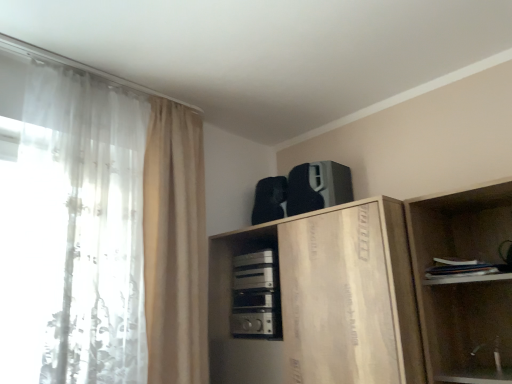
Question: Which direction should I rotate to face black matte speaker at upper center, marked as the second appliance in a bottom-to-top arrangement, — up or down?

Choices:
 (A) down
 (B) up

Answer: (A)

Question: From a real-world perspective, is white sheer curtain at left, which appears as the first curtain when viewed from the left, beneath white paper book at right?

Choices:
 (A) no
 (B) yes

Answer: (A)

Question: Could you tell me if white sheer curtain at left, acting as the second curtain starting from the right, is facing white paper book at right?

Choices:
 (A) no
 (B) yes

Answer: (A)

Question: Can you confirm if white sheer curtain at left, which appears as the first curtain when viewed from the left, is thinner than white paper book at right?

Choices:
 (A) no
 (B) yes

Answer: (A)

Question: Is there a large distance between white sheer curtain at left, acting as the second curtain starting from the right, and white paper book at right?

Choices:
 (A) yes
 (B) no

Answer: (A)

Question: Is white sheer curtain at left, acting as the second curtain starting from the right, next to white paper book at right?

Choices:
 (A) yes
 (B) no

Answer: (B)

Question: Could white paper book at right be considered to be inside white sheer curtain at left, acting as the second curtain starting from the right?

Choices:
 (A) no
 (B) yes

Answer: (A)

Question: Considering the relative sizes of beige fabric curtain at left, which is counted as the 1th curtain, starting from the right, and white sheer curtain at left, acting as the second curtain starting from the right, in the image provided, is beige fabric curtain at left, which is counted as the 1th curtain, starting from the right, bigger than white sheer curtain at left, acting as the second curtain starting from the right,?

Choices:
 (A) no
 (B) yes

Answer: (B)

Question: Is beige fabric curtain at left, which ranks as the second curtain in left-to-right order, surrounding white sheer curtain at left, acting as the second curtain starting from the right?

Choices:
 (A) yes
 (B) no

Answer: (B)

Question: Does beige fabric curtain at left, which is counted as the 1th curtain, starting from the right, appear on the left side of white sheer curtain at left, acting as the second curtain starting from the right?

Choices:
 (A) no
 (B) yes

Answer: (A)

Question: Is beige fabric curtain at left, which is counted as the 1th curtain, starting from the right, facing towards white sheer curtain at left, which appears as the first curtain when viewed from the left?

Choices:
 (A) no
 (B) yes

Answer: (A)

Question: Considering the relative sizes of beige fabric curtain at left, which is counted as the 1th curtain, starting from the right, and white sheer curtain at left, acting as the second curtain starting from the right, in the image provided, is beige fabric curtain at left, which is counted as the 1th curtain, starting from the right, thinner than white sheer curtain at left, acting as the second curtain starting from the right,?

Choices:
 (A) yes
 (B) no

Answer: (B)

Question: Is beige fabric curtain at left, which ranks as the second curtain in left-to-right order, with white sheer curtain at left, which appears as the first curtain when viewed from the left?

Choices:
 (A) yes
 (B) no

Answer: (A)

Question: From the image's perspective, is satin silver appliance at center, positioned as the 1th appliance in bottom-to-top order, beneath black matte speaker at upper center, positioned as the first appliance in top-to-bottom order?

Choices:
 (A) yes
 (B) no

Answer: (A)